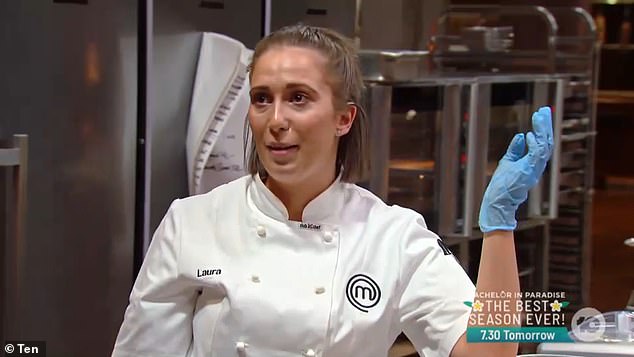
Where is `list on paper taped to refrigerator`? list on paper taped to refrigerator is located at coordinates [x=215, y=126].